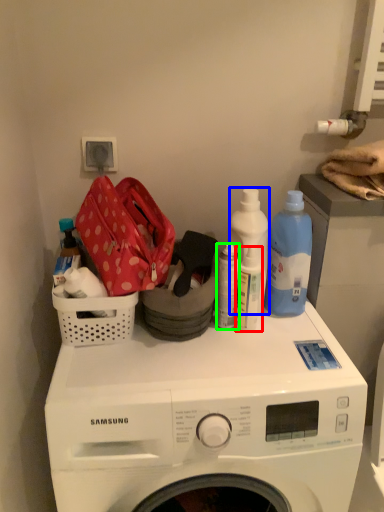
Question: Which is nearer to the cleaning product (highlighted by a red box)? cleaning product (highlighted by a blue box) or bottle (highlighted by a green box).

Choices:
 (A) cleaning product
 (B) bottle

Answer: (B)